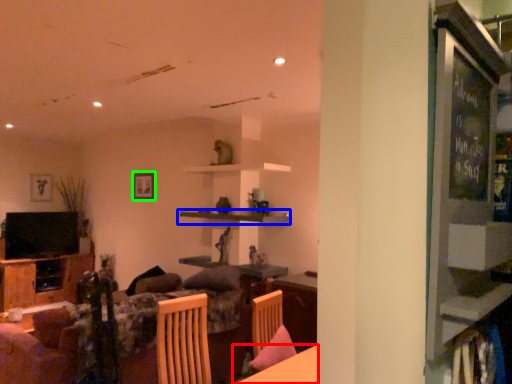
Question: Estimate the real-world distances between objects in this image. Which object is closer to table (highlighted by a red box), shelf (highlighted by a blue box) or picture frame (highlighted by a green box)?

Choices:
 (A) shelf
 (B) picture frame

Answer: (A)